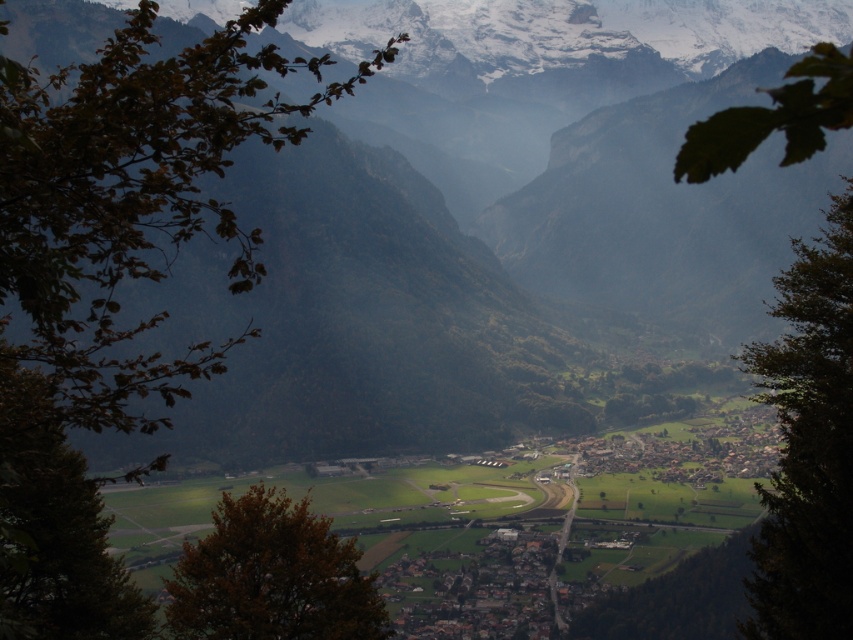
Question: Does green grassy field at center appear under brown leafy branch at upper left?

Choices:
 (A) no
 (B) yes

Answer: (B)

Question: Which point is farther to the camera?

Choices:
 (A) click(3, 456)
 (B) click(549, 298)
 (C) click(199, 577)
 (D) click(656, 616)

Answer: (B)

Question: Can you confirm if green leafy tree at right is positioned below green leafy tree at center?

Choices:
 (A) yes
 (B) no

Answer: (B)

Question: Which point is farther to the camera?

Choices:
 (A) green grassy field at center
 (B) green leafy tree at right
 (C) brown leafy tree at center

Answer: (C)

Question: Which of the following is the farthest from the observer?

Choices:
 (A) (236, 118)
 (B) (772, 356)
 (C) (706, 596)

Answer: (C)

Question: Considering the relative positions of green grassy field at center and brown leafy branch at upper left in the image provided, where is green grassy field at center located with respect to brown leafy branch at upper left?

Choices:
 (A) right
 (B) left

Answer: (A)